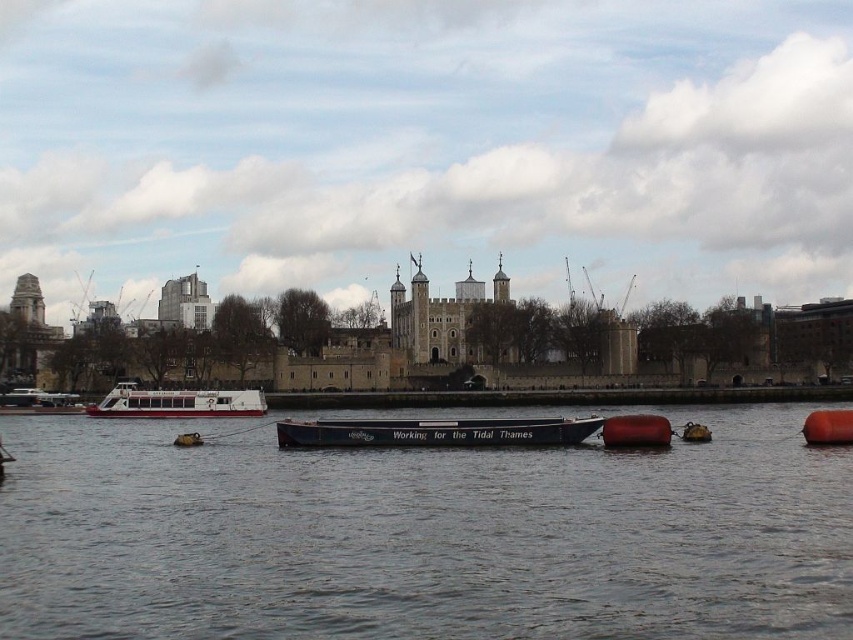
You are standing on the bank of the River Thames near the Tower of London. You see the white matte boat at left and the orange rubber buoy at lower right. Which object is closer to you?

The white matte boat at left is closer to you since it is further to the viewer than the orange rubber buoy at lower right.

You are a tourist standing on the bank of the River Thames, looking at the Tower of London. You notice the black matte boat at center and the orange rubber buoy at lower right. Which object is taller from your viewpoint?

The orange rubber buoy at lower right is taller than the black matte boat at center from your viewpoint.

You are a tourist standing on the bank of the River Thames, looking at the Tower of London. You see the white matte boat at center and the rubber buoy at center. Which object is closer to you?

The white matte boat at center is closer to you because it is further to the viewer than the rubber buoy at center.